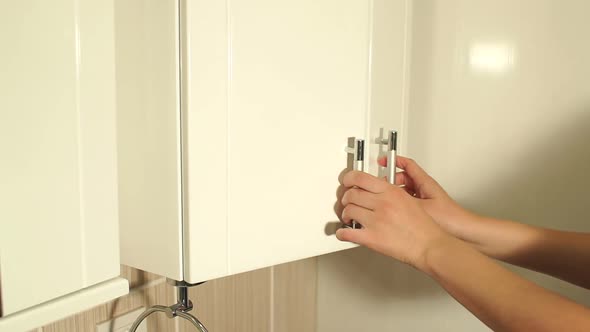
Where is `outlet plug`? This screenshot has width=590, height=332. outlet plug is located at coordinates (122, 327).